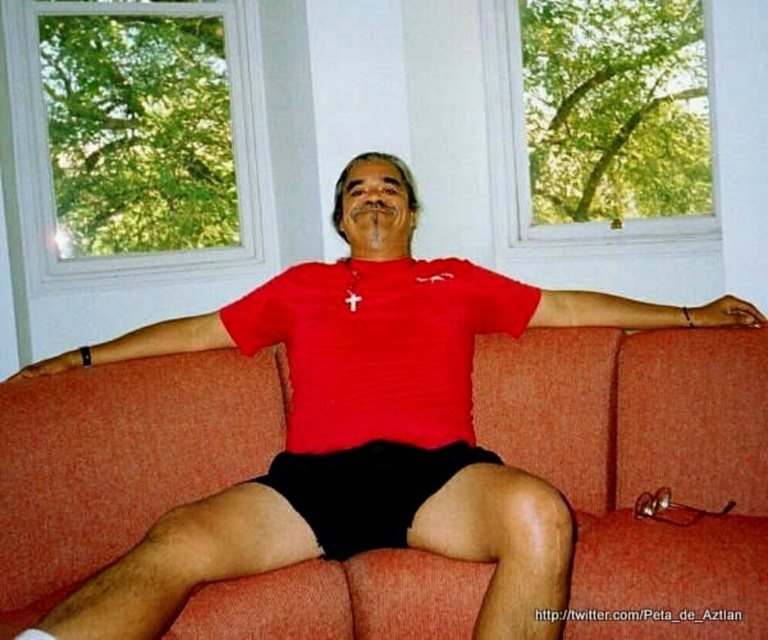
Between orange fabric couch at center and black matte shorts at center, which one appears on the right side from the viewer's perspective?

From the viewer's perspective, orange fabric couch at center appears more on the right side.

Can you confirm if orange fabric couch at center is smaller than black matte shorts at center?

No, orange fabric couch at center is not smaller than black matte shorts at center.

The image size is (768, 640). I want to click on orange fabric couch at center, so click(644, 467).